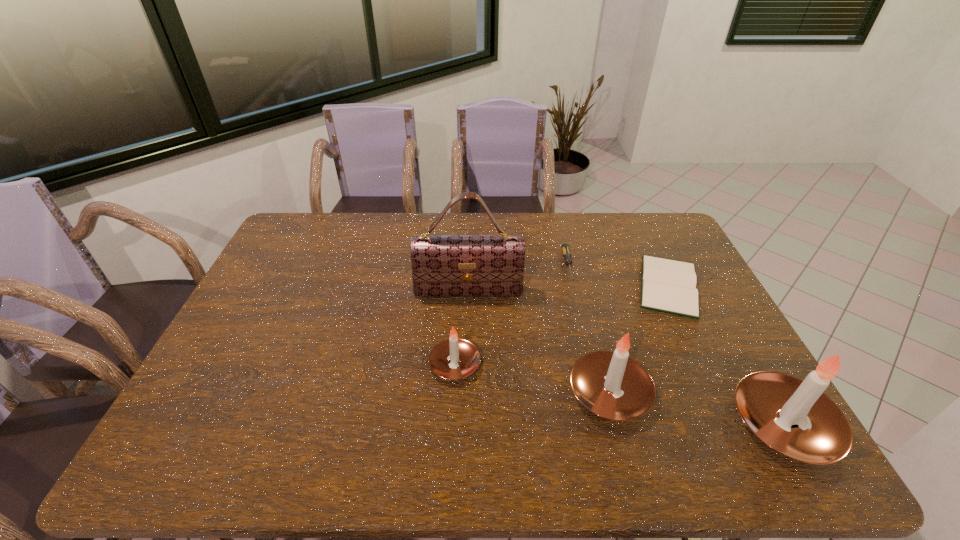
Image resolution: width=960 pixels, height=540 pixels. I want to click on vacant space located 0.060m on the left of the rightmost candle, so 708,424.

This screenshot has height=540, width=960. What are the coordinates of `free location located insert the screwdriver into a screw head` in the screenshot? It's located at (588, 346).

The image size is (960, 540). I want to click on vacant space located 0.200m on the front of the handbag with the clasp, so click(467, 353).

Where is `free space located on the left of the hardback book`? The height and width of the screenshot is (540, 960). free space located on the left of the hardback book is located at coordinates (540, 285).

Where is `object that is at the far edge`? The width and height of the screenshot is (960, 540). object that is at the far edge is located at coordinates (565, 248).

Locate an element on the screen. candle positioned at the right edge is located at coordinates (794, 417).

Find the location of a particular element. Image resolution: width=960 pixels, height=540 pixels. hardback book positioned at the right edge is located at coordinates click(667, 285).

Where is `object located at the near right corner`? The height and width of the screenshot is (540, 960). object located at the near right corner is located at coordinates (794, 417).

I want to click on vacant space at the far edge, so click(x=619, y=215).

In the image, there is a desktop. Where is `vacant space at the near edge`? vacant space at the near edge is located at coordinates (522, 401).